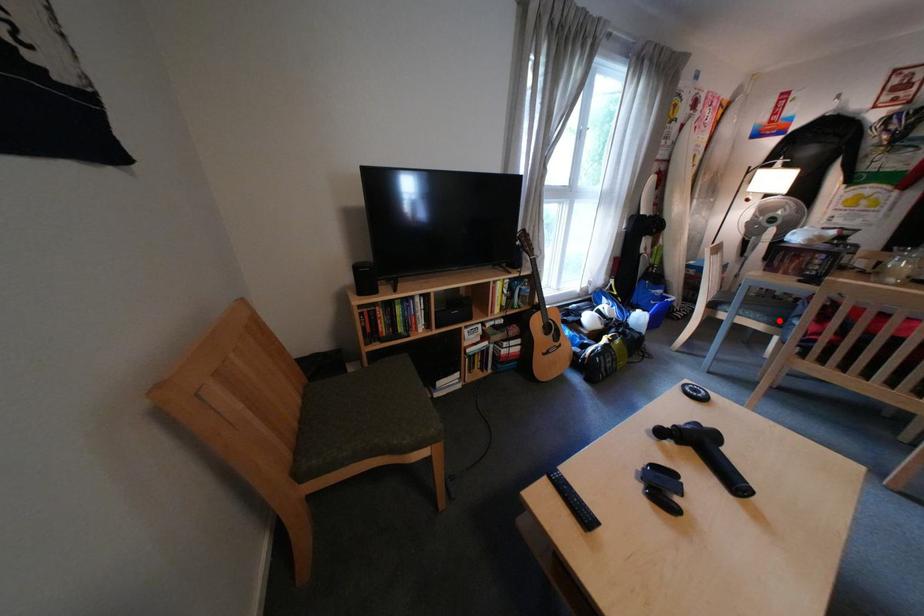
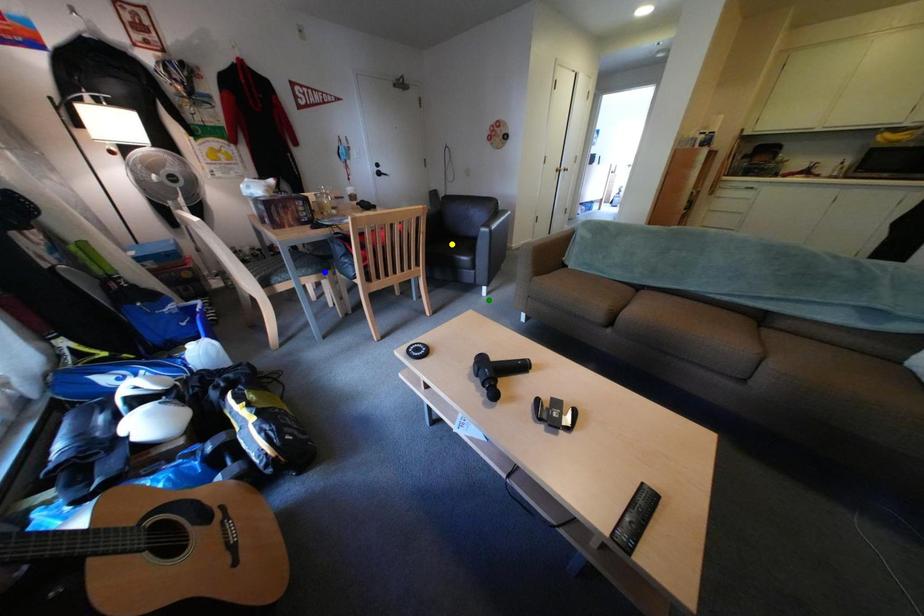
Question: I am providing you with two images of the same scene from different viewpoints. A red point is marked on the first image. You are given multiple points on the second image. Can you choose the point in image 2 that corresponds to the point in image 1?

Choices:
 (A) blue point
 (B) yellow point
 (C) green point

Answer: (A)